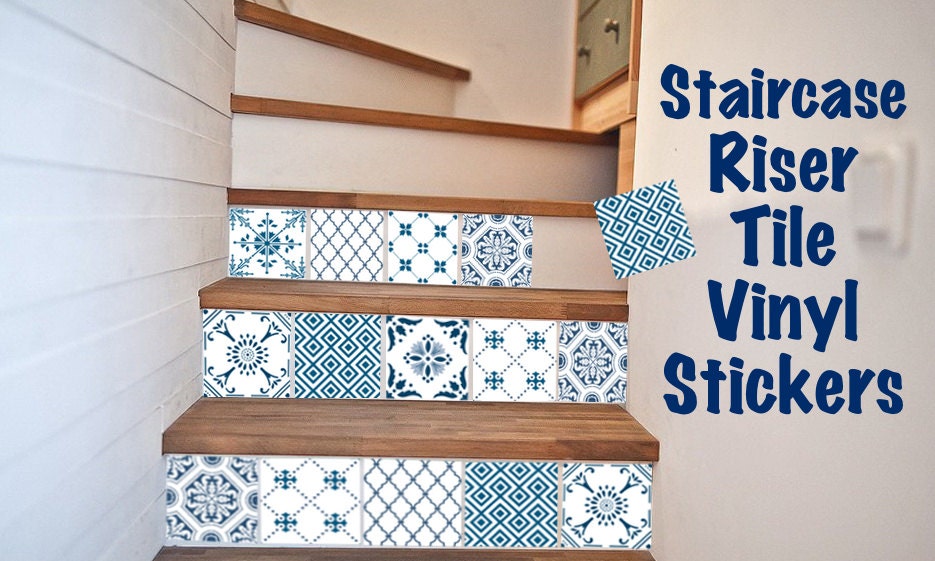
Find the location of a particular element. This screenshot has height=561, width=935. wooden steps is located at coordinates (415, 559), (409, 434), (383, 302), (368, 205), (367, 112), (367, 45).